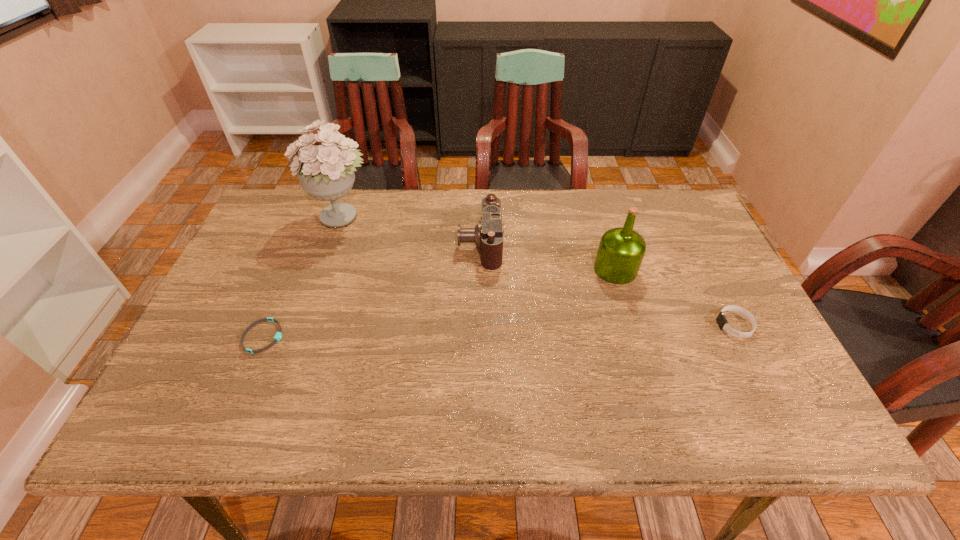
Locate an element on the screen. object that is the closest to the rightmost object is located at coordinates (621, 250).

Locate an element on the screen. This screenshot has height=540, width=960. object that stands as the third closest to the right wristband is located at coordinates (326, 172).

Where is `free space in the image that satisfies the following two spatial constraints: 1. on the front-facing side of the camera; 2. on the back side of the olive oil`? This screenshot has width=960, height=540. free space in the image that satisfies the following two spatial constraints: 1. on the front-facing side of the camera; 2. on the back side of the olive oil is located at coordinates (480, 269).

Identify the location of free region that satisfies the following two spatial constraints: 1. on the front side of the tallest object; 2. on the buckle of the shortest object. The image size is (960, 540). click(300, 336).

The image size is (960, 540). Find the location of `vacant area that satisfies the following two spatial constraints: 1. on the front side of the tallest object; 2. on the buckle of the shorter wristband`. vacant area that satisfies the following two spatial constraints: 1. on the front side of the tallest object; 2. on the buckle of the shorter wristband is located at coordinates (300, 336).

The height and width of the screenshot is (540, 960). I want to click on free space that satisfies the following two spatial constraints: 1. on the front-facing side of the third tallest object; 2. on the back side of the olive oil, so click(480, 269).